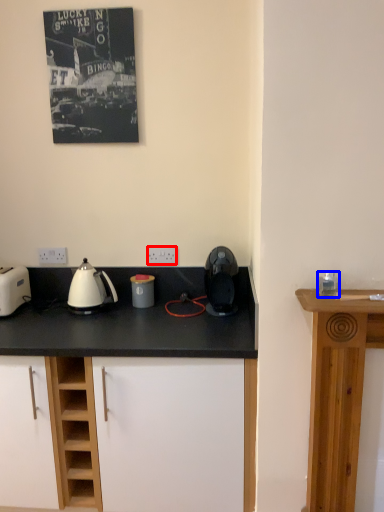
Question: Which point is further to the camera, electric outlet (highlighted by a red box) or appliance (highlighted by a blue box)?

Choices:
 (A) electric outlet
 (B) appliance

Answer: (A)